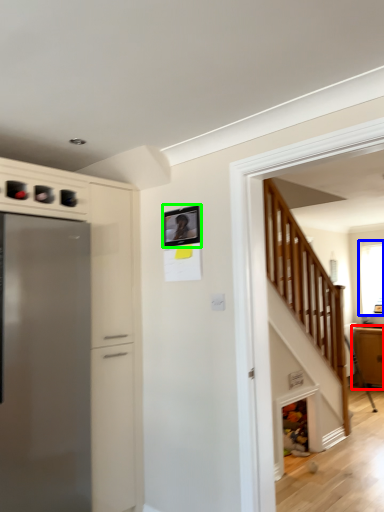
Question: Which object is the closest to the cabinetry (highlighted by a red box)? Choose among these: window (highlighted by a blue box) or picture frame (highlighted by a green box).

Choices:
 (A) window
 (B) picture frame

Answer: (A)